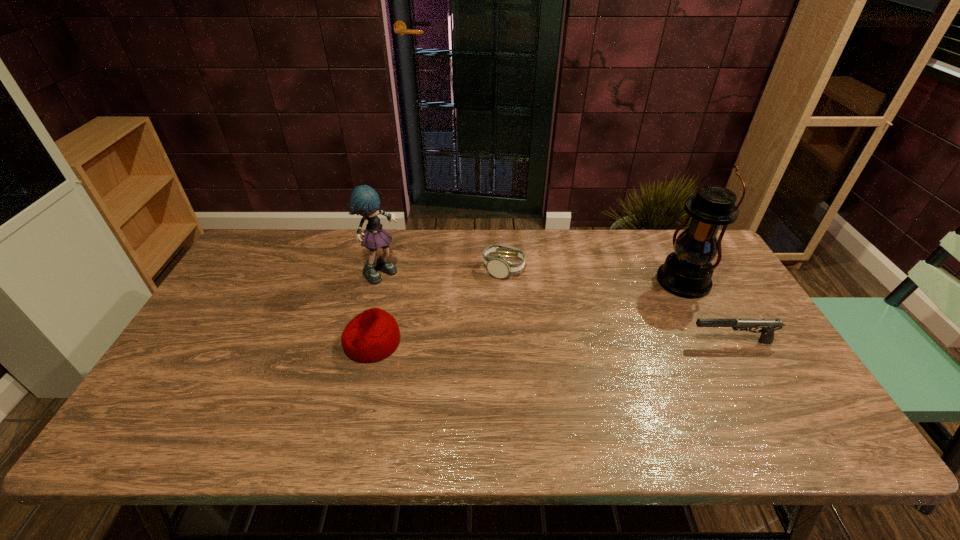
The width and height of the screenshot is (960, 540). I want to click on free space at the far left corner of the desktop, so click(260, 236).

Image resolution: width=960 pixels, height=540 pixels. What are the coordinates of `vacant space in between the gun and the watch` in the screenshot? It's located at (618, 306).

Where is `vacant region between the beanbag and the lantern`? The height and width of the screenshot is (540, 960). vacant region between the beanbag and the lantern is located at coordinates (527, 312).

Find the location of a particular element. Image resolution: width=960 pixels, height=540 pixels. vacant point located between the second tallest object and the beanbag is located at coordinates (377, 307).

At what (x,y) coordinates should I click in order to perform the action: click on free space between the gun and the beanbag. Please return your answer as a coordinate pair (x, y). Image resolution: width=960 pixels, height=540 pixels. Looking at the image, I should click on (552, 342).

What are the coordinates of `free space between the second tallest object and the beanbag` in the screenshot? It's located at (377, 307).

The image size is (960, 540). I want to click on vacant space that's between the second tallest object and the watch, so click(x=444, y=271).

Where is `vacant space in between the rag doll and the beanbag`? The image size is (960, 540). vacant space in between the rag doll and the beanbag is located at coordinates (377, 307).

What are the coordinates of `empty location between the watch and the gun` in the screenshot? It's located at (618, 306).

At what (x,y) coordinates should I click in order to perform the action: click on vacant space that's between the lantern and the gun. Please return your answer as a coordinate pair (x, y). Image resolution: width=960 pixels, height=540 pixels. Looking at the image, I should click on (708, 312).